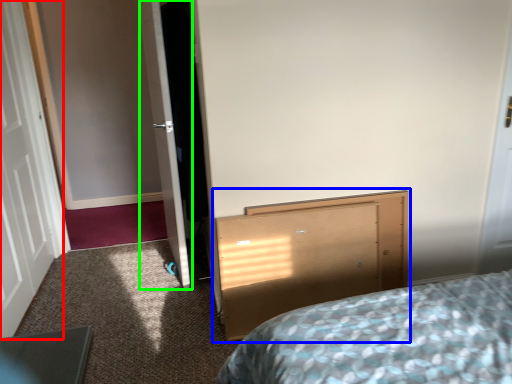
Question: Considering the real-world distances, which object is farthest from door (highlighted by a red box)? vanity (highlighted by a blue box) or door (highlighted by a green box)?

Choices:
 (A) vanity
 (B) door

Answer: (A)